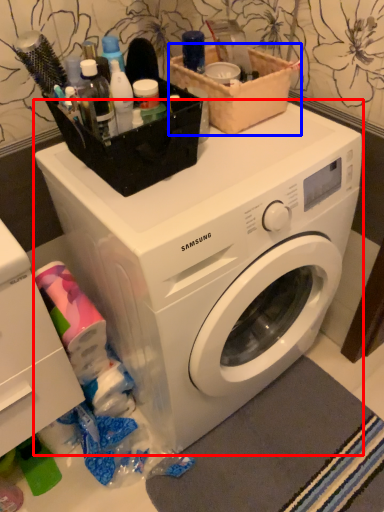
Question: Which point is closer to the camera, washing machine (highlighted by a red box) or basket (highlighted by a blue box)?

Choices:
 (A) washing machine
 (B) basket

Answer: (A)